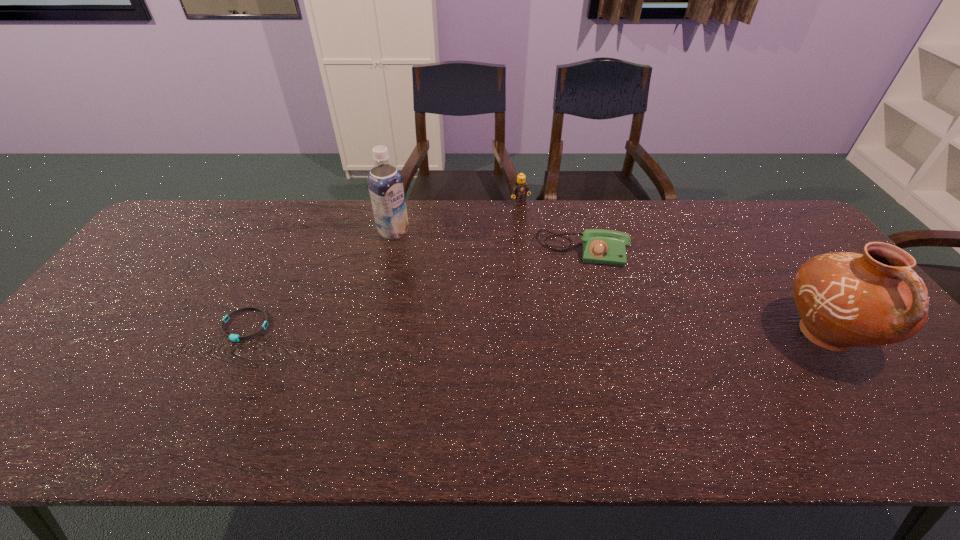
Identify the location of vacant area that lies between the leftmost object and the pottery. (536, 330).

The height and width of the screenshot is (540, 960). I want to click on vacant area that lies between the fourth object from right to left and the leftmost object, so click(x=320, y=279).

Identify the location of free space between the telephone and the pottery. (704, 293).

Locate an element on the screen. This screenshot has height=540, width=960. empty space between the third shortest object and the leftmost object is located at coordinates (383, 265).

Where is `vacant area that lies between the soya milk and the farthest object`? Image resolution: width=960 pixels, height=540 pixels. vacant area that lies between the soya milk and the farthest object is located at coordinates (457, 218).

This screenshot has width=960, height=540. What are the coordinates of `vacant point located between the leftmost object and the fourth object from right to left` in the screenshot? It's located at (320, 279).

This screenshot has height=540, width=960. In order to click on object that stands as the third closest to the rightmost object in this screenshot , I will do `click(385, 183)`.

Select which object appears as the closest to the leftmost object. Please provide its 2D coordinates. Your answer should be formatted as a tuple, i.e. [(x, y)], where the tuple contains the x and y coordinates of a point satisfying the conditions above.

[(385, 183)]